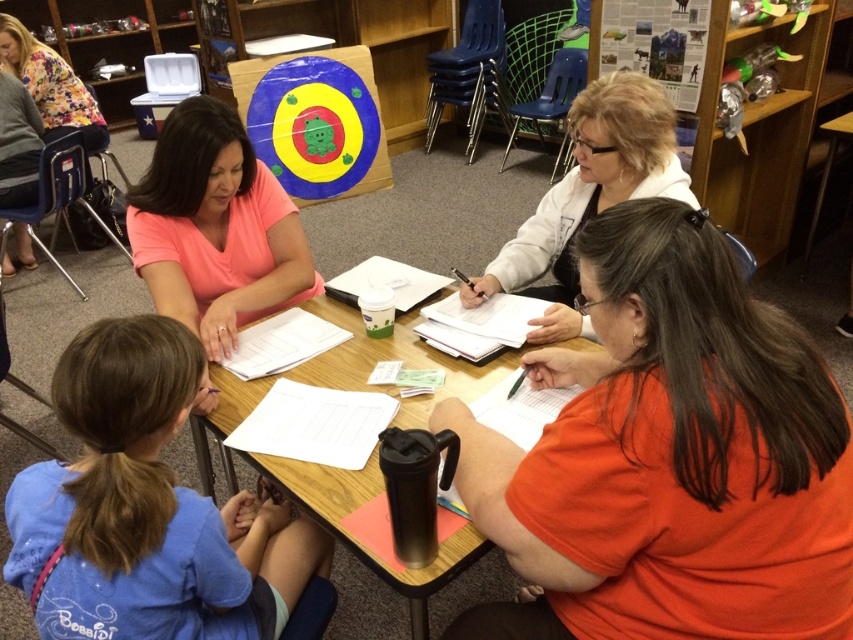
You are organizing a classroom event and need to ensure that all participants can comfortably sit around the table. Given that the blue cotton shirt at lower left is a participant, and the black plastic table at center is the main table, can you determine if the table is wide enough to accommodate the participant comfortably?

The blue cotton shirt at lower left has a width less than the black plastic table at center, so the table is wide enough to accommodate the participant comfortably.

You are a teacher in the classroom looking at the image. You need to locate the blue cotton shirt at lower left and the white fleece jacket at upper center. Which one is closer to the bottom of the image?

The blue cotton shirt at lower left is closer to the bottom of the image because it is positioned under the white fleece jacket at upper center.

You are a student sitting at the black plastic table at center. You want to hand a paper to the person in the pink matte shirt at upper left. Can you reach them without moving from your seat?

The pink matte shirt at upper left is taller than the black plastic table at center, so you can reach them by extending your arm over the table.